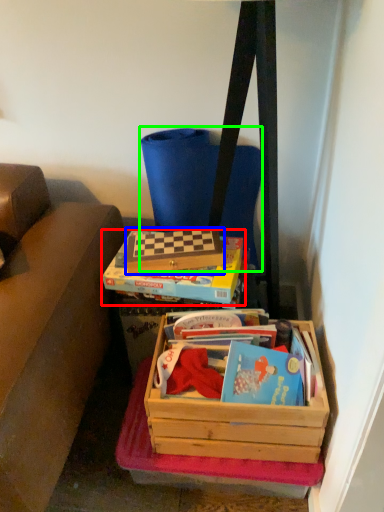
Question: Which is farther away from box (highlighted by a red box)? box (highlighted by a blue box) or messenger bag (highlighted by a green box)?

Choices:
 (A) box
 (B) messenger bag

Answer: (B)